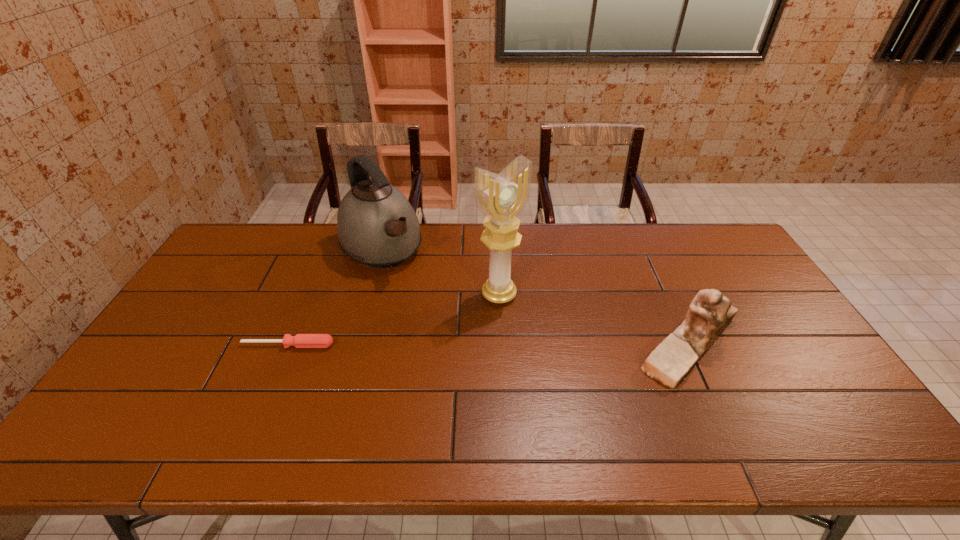
At what (x,y) coordinates should I click in order to perform the action: click on free location at the near edge of the desktop. Please return your answer as a coordinate pair (x, y). Looking at the image, I should click on click(x=338, y=403).

You are a GUI agent. You are given a task and a screenshot of the screen. Output one action in this format:
    pyautogui.click(x=<x>, y=<y>)
    Task: Click on the free spot at the right edge of the desktop
    The height and width of the screenshot is (540, 960).
    Given the screenshot: What is the action you would take?
    pyautogui.click(x=722, y=290)

At what (x,y) coordinates should I click in order to perform the action: click on blank space at the far left corner of the desktop. Please return your answer as a coordinate pair (x, y). Looking at the image, I should click on (251, 227).

Where is `free space at the far right corner of the desktop`? The height and width of the screenshot is (540, 960). free space at the far right corner of the desktop is located at coordinates (733, 254).

Where is `unoccupied position between the figurine and the third shortest object`? unoccupied position between the figurine and the third shortest object is located at coordinates (536, 297).

Locate an element on the screen. This screenshot has height=540, width=960. free space between the figurine and the award is located at coordinates (594, 320).

The width and height of the screenshot is (960, 540). I want to click on empty space that is in between the award and the screwdriver, so click(394, 320).

This screenshot has height=540, width=960. What are the coordinates of `free spot between the farthest object and the tallest object` in the screenshot? It's located at (441, 272).

You are a GUI agent. You are given a task and a screenshot of the screen. Output one action in this format:
    pyautogui.click(x=<x>, y=<y>)
    Task: Click on the vacant space that's between the kettle and the figurine
    
    Given the screenshot: What is the action you would take?
    pyautogui.click(x=536, y=297)

Locate an element on the screen. This screenshot has height=540, width=960. empty space that is in between the second tallest object and the third tallest object is located at coordinates (536, 297).